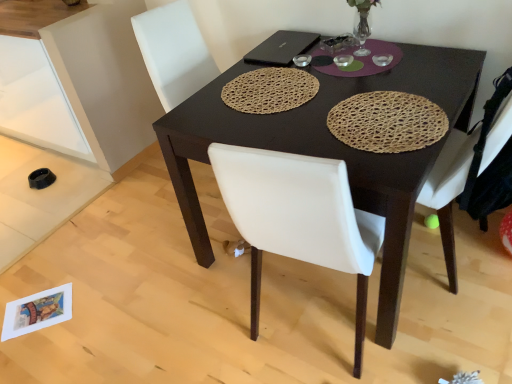
In order to click on empty space that is in between woven straw placemat at center, the 2th mat when ordered from left to right, and black matte laptop at upper center in this screenshot , I will do `click(323, 82)`.